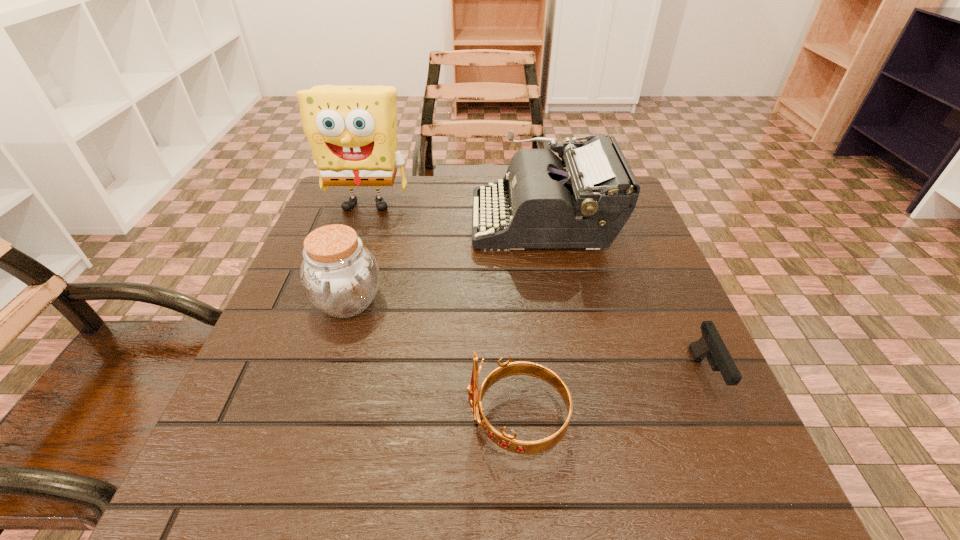
The image size is (960, 540). I want to click on free space that is in between the typewriter and the jar, so click(445, 261).

Where is `empty space between the rightmost object and the tallest object`? This screenshot has width=960, height=540. empty space between the rightmost object and the tallest object is located at coordinates (536, 289).

At what (x,y) coordinates should I click in order to perform the action: click on vacant region between the typewriter and the tiara. Please return your answer as a coordinate pair (x, y). The height and width of the screenshot is (540, 960). Looking at the image, I should click on (530, 320).

Locate an element on the screen. This screenshot has width=960, height=540. free space between the typewriter and the third farthest object is located at coordinates (445, 261).

The width and height of the screenshot is (960, 540). Find the location of `unoccupied position between the third farthest object and the typewriter`. unoccupied position between the third farthest object and the typewriter is located at coordinates (445, 261).

At what (x,y) coordinates should I click in order to perform the action: click on free space between the sponge and the tiara. Please return your answer as a coordinate pair (x, y). The height and width of the screenshot is (540, 960). Looking at the image, I should click on (443, 312).

What are the coordinates of `free spot between the third nearest object and the rightmost object` in the screenshot? It's located at (526, 339).

This screenshot has width=960, height=540. Find the location of `free area in between the jar and the tiara`. free area in between the jar and the tiara is located at coordinates (432, 361).

Identify the location of free space between the tiara and the typewriter. The image size is (960, 540). (530, 320).

Select which object is the second closest to the typewriter. Please provide its 2D coordinates. Your answer should be formatted as a tuple, i.e. [(x, y)], where the tuple contains the x and y coordinates of a point satisfying the conditions above.

[(339, 276)]